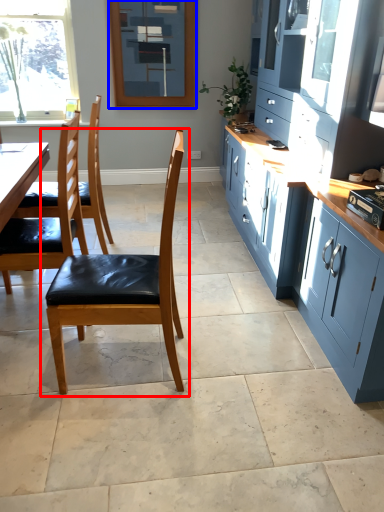
Question: Which object appears farthest to the camera in this image, chair (highlighted by a red box) or window screen (highlighted by a blue box)?

Choices:
 (A) chair
 (B) window screen

Answer: (B)